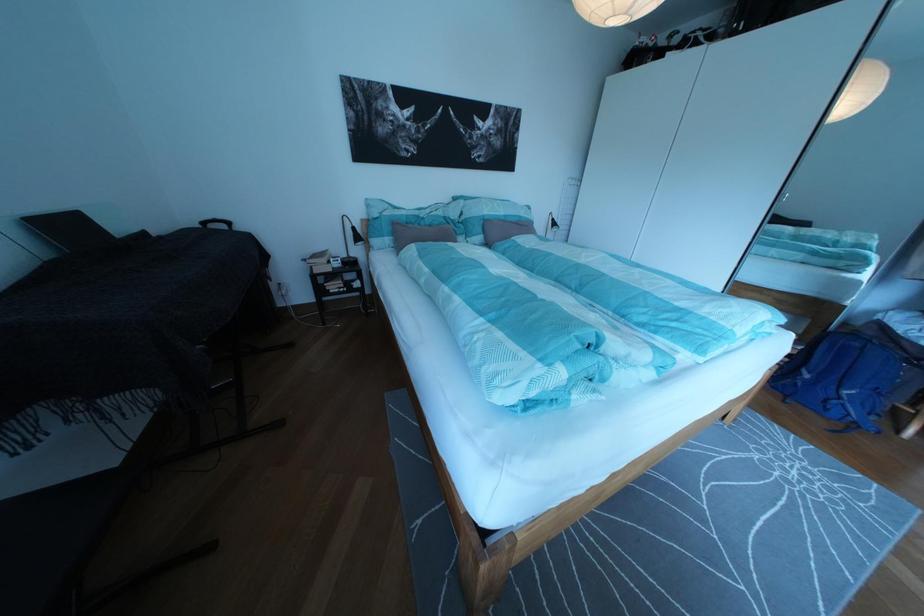
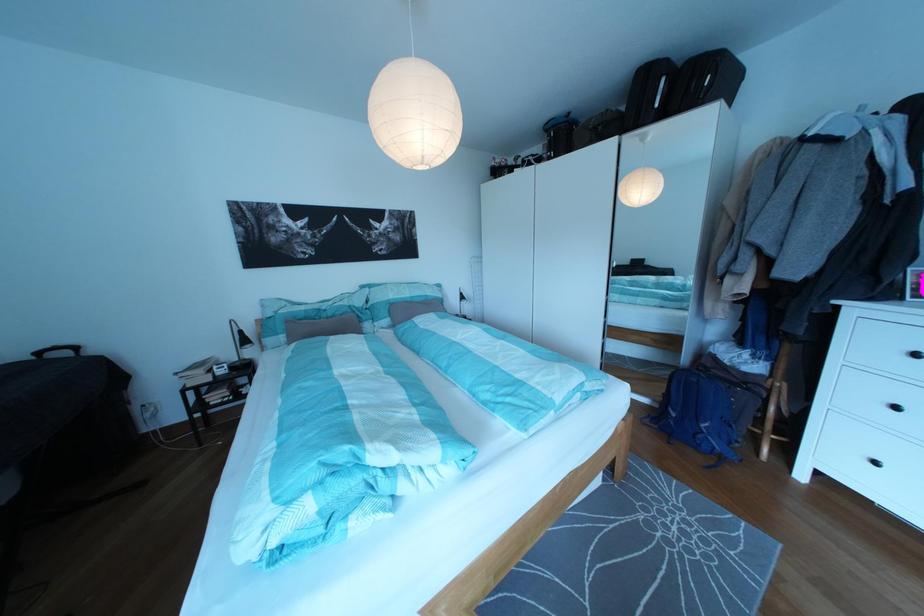
Question: The images are taken continuously from a first-person perspective. In which direction is your viewpoint rotating?

Choices:
 (A) Left
 (B) Right
 (C) Up
 (D) Down

Answer: (C)